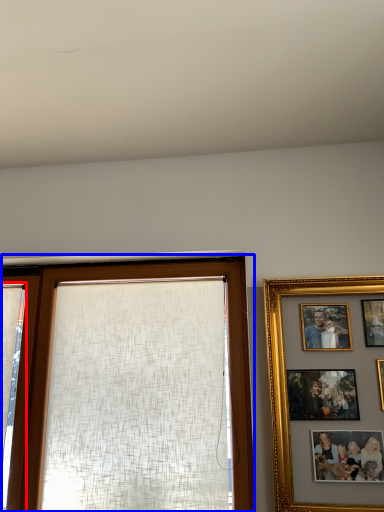
Question: Among these objects, which one is farthest to the camera, curtain (highlighted by a red box) or window (highlighted by a blue box)?

Choices:
 (A) curtain
 (B) window

Answer: (A)